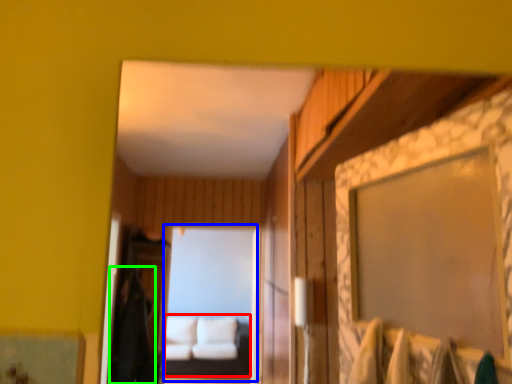
Question: Estimate the real-world distances between objects in this image. Which object is farther from couch (highlighted by a red box), mirror (highlighted by a blue box) or robe (highlighted by a green box)?

Choices:
 (A) mirror
 (B) robe

Answer: (B)